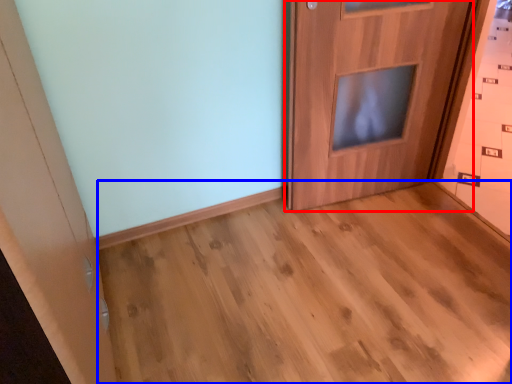
Question: Which object appears farthest to the camera in this image, door (highlighted by a red box) or corridor (highlighted by a blue box)?

Choices:
 (A) door
 (B) corridor

Answer: (A)